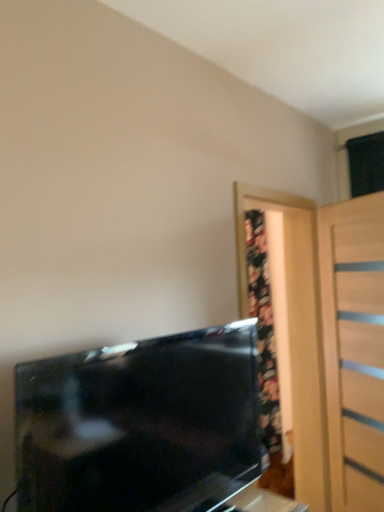
Question: Looking at their shapes, would you say light wood door at right is wider or thinner than black glossy tv at lower left?

Choices:
 (A) thin
 (B) wide

Answer: (A)

Question: Relative to black glossy tv at lower left, is light wood door at right in front or behind?

Choices:
 (A) behind
 (B) front

Answer: (A)

Question: Which object is positioned closest to the black glossy tv at lower left?

Choices:
 (A) matte black tv at lower left
 (B) light wood door at right

Answer: (B)

Question: Considering the real-world distances, which object is closest to the black glossy tv at lower left?

Choices:
 (A) light wood door at right
 (B) matte black tv at lower left

Answer: (A)